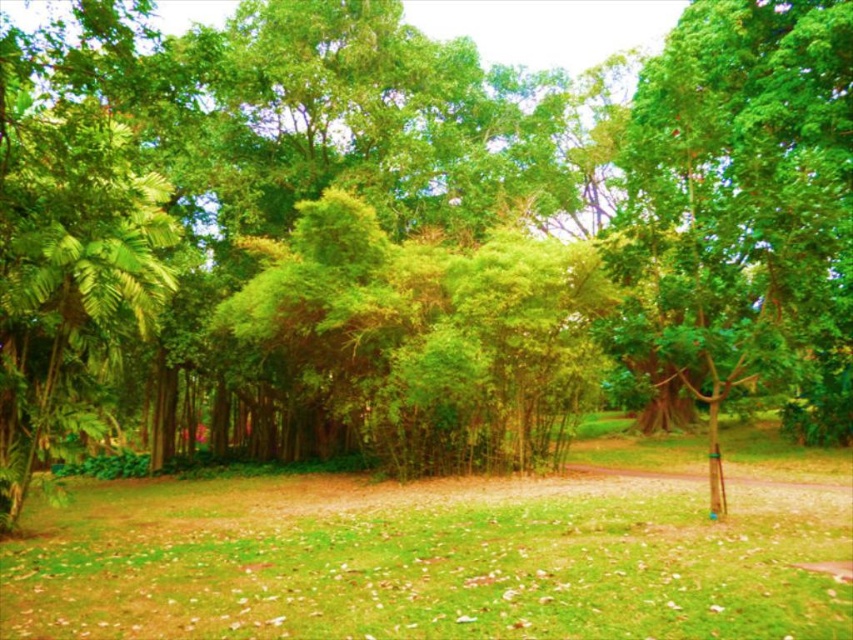
You are a hiker who wants to take a photo of both the green grass at center and the green leafy tree at right. Since you want both in the frame, which direction should you move to ensure both are visible?

You should move to the left side of the green leafy tree at right so that the green grass at center, which is positioned on the left side of the green leafy tree at right, comes into view.